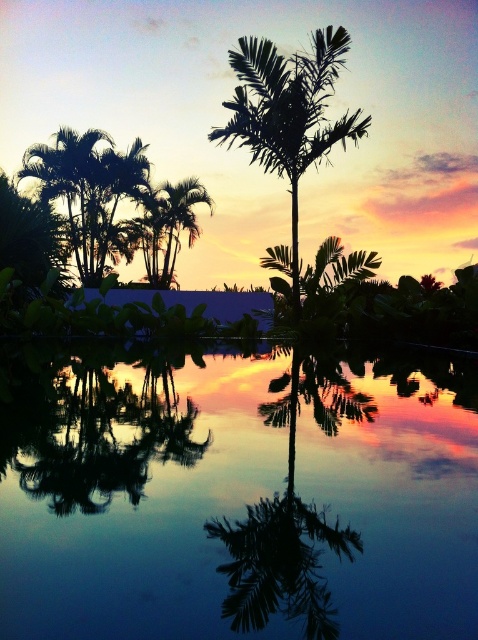
You are standing at the edge of the transparent glass pond at center and want to see the green leafy palm tree at center reflected in the water. Can you see the entire tree in the reflection?

The transparent glass pond at center is smaller than the green leafy palm tree at center, so the reflection might not capture the entire tree due to the pond being too small to encompass its full size.

You are standing on the shore of the transparent glass pond at center and looking towards the green leafy palm tree at center. Which object is taller?

The green leafy palm tree at center is taller than the transparent glass pond at center.

You are standing at the edge of the transparent glass pond at center and want to see the black glossy palm tree at center. Which object would appear closer to you in the reflection? Please explain your reasoning based on their sizes and positions.

The black glossy palm tree at center would appear closer in the reflection because it is larger than the transparent glass pond at center, and reflections maintain the relative sizes and positions of objects.